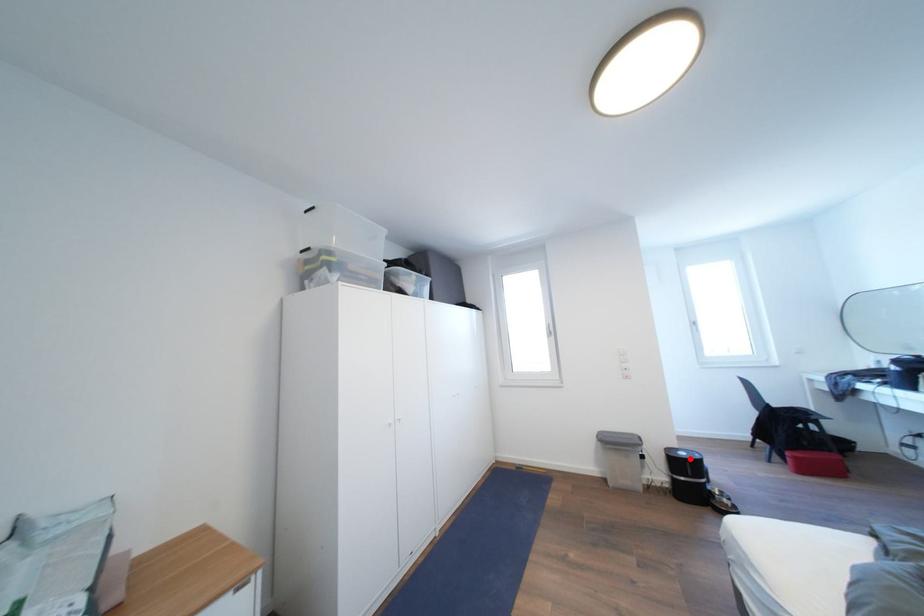
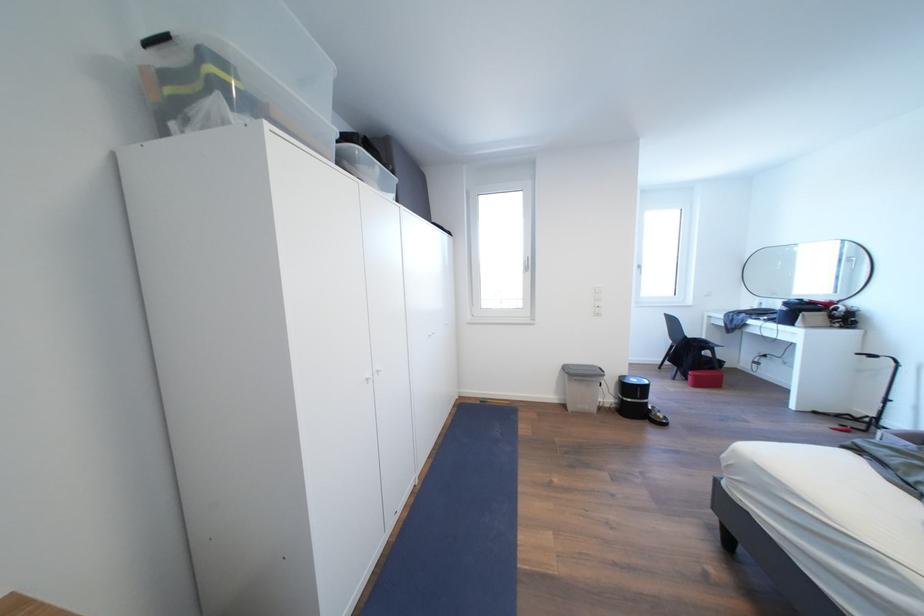
Question: I am providing you with two images of the same scene from different viewpoints. A red point is shown in image1. For the corresponding object point in image2, is it positioned nearer or farther from the camera?

Choices:
 (A) Nearer
 (B) Farther

Answer: (B)